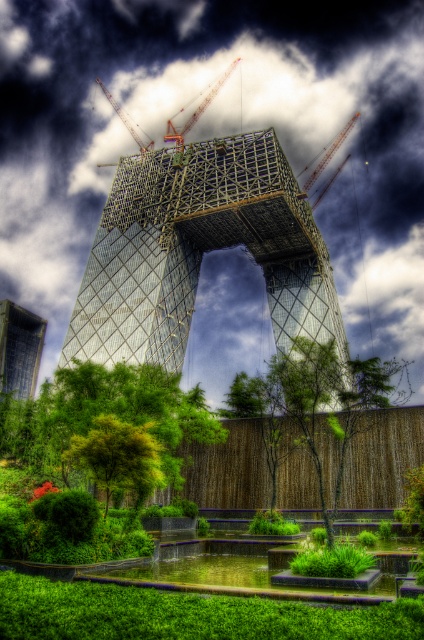
Question: Which point is closer to the camera?

Choices:
 (A) orange metallic crane at upper center
 (B) metallic red crane at upper center
 (C) white fluffy cloud at upper center
 (D) green leafy tree at center

Answer: (D)

Question: Which point is closer to the camera?

Choices:
 (A) (178, 176)
 (B) (334, 140)
 (C) (212, 90)

Answer: (A)

Question: Can you confirm if metallic glass skyscraper at center is positioned below metallic construction crane at upper center?

Choices:
 (A) yes
 (B) no

Answer: (A)

Question: From the image, what is the correct spatial relationship of metallic glass skyscraper at center in relation to metallic construction crane at upper center?

Choices:
 (A) above
 (B) below

Answer: (B)

Question: From the image, what is the correct spatial relationship of green leafy tree at lower left in relation to metallic red crane at upper center?

Choices:
 (A) below
 (B) above

Answer: (A)

Question: Based on their relative distances, which object is nearer to the glassy transparent tower at lower left?

Choices:
 (A) white fluffy cloud at upper center
 (B) metallic red crane at upper center
 (C) green leafy tree at lower left
 (D) green leafy tree at center

Answer: (A)